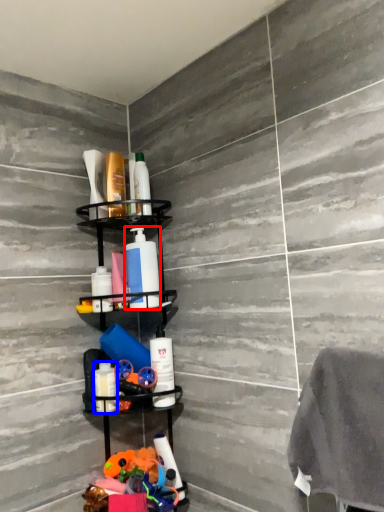
Question: Which of the following is the closest to the observer, cleaning product (highlighted by a red box) or toiletry (highlighted by a blue box)?

Choices:
 (A) cleaning product
 (B) toiletry

Answer: (B)